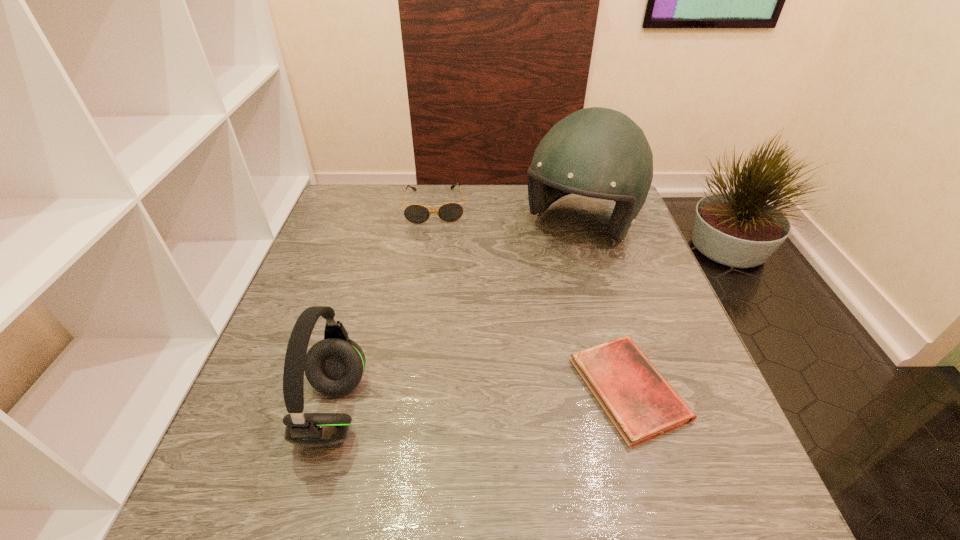
The height and width of the screenshot is (540, 960). In order to click on free spot that satisfies the following two spatial constraints: 1. on the front side of the tallest object; 2. on the right side of the shortest object in this screenshot , I will do `click(626, 389)`.